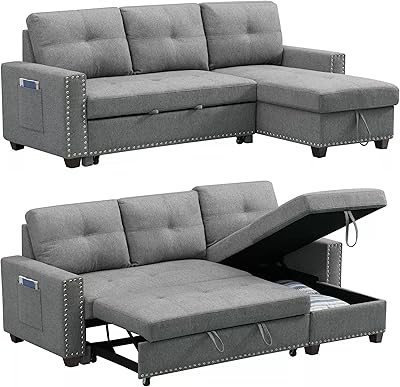
Find the location of a particular element. The width and height of the screenshot is (400, 387). couch is located at coordinates (151, 57), (154, 266).